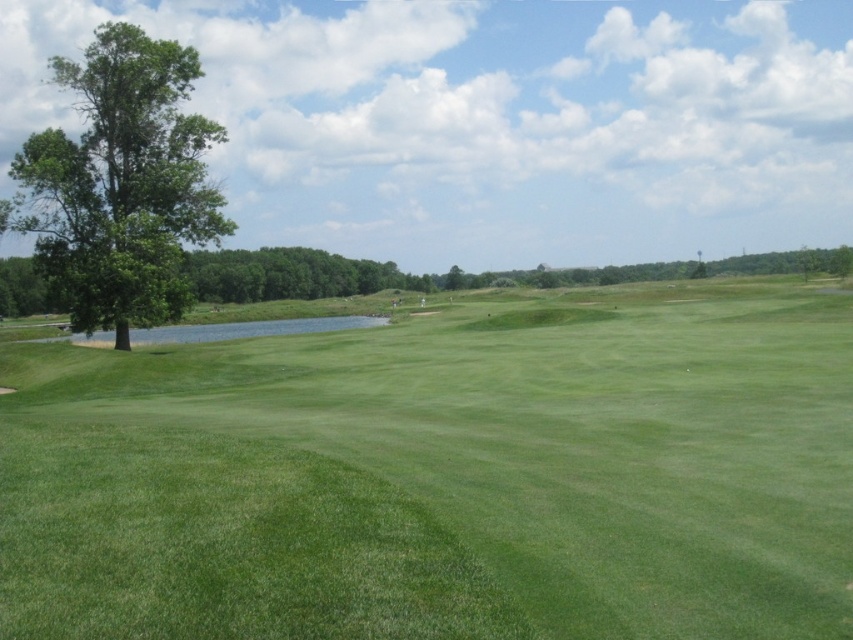
You are a golfer standing on the green grassy field at center and want to hit a ball towards the green leafy tree at left. Considering the height difference between them, will the tree block your view of the ball once it lands near the tree?

The green grassy field at center has a lesser height compared to green leafy tree at left, so the tree might block your view of the ball once it lands near the tree because the tree is taller.

You are standing at the center of the image and want to walk to the green grassy field at center. Which direction should you walk?

The green grassy field at center is already at the center of the image, so you are already at the desired location.